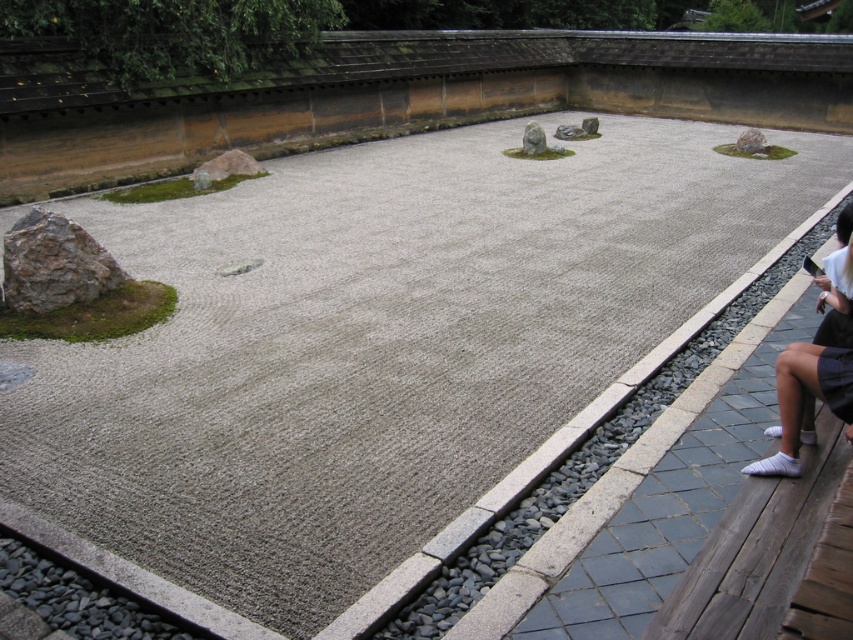
From the picture: Can you confirm if white fabric at right is smaller than rusty brown rock at left?

No.

Between white fabric at right and rusty brown rock at left, which one has more height?

white fabric at right

The height and width of the screenshot is (640, 853). Describe the element at coordinates (805, 400) in the screenshot. I see `white fabric at right` at that location.

At what (x,y) coordinates should I click in order to perform the action: click on white fabric at right. Please return your answer as a coordinate pair (x, y). The width and height of the screenshot is (853, 640). Looking at the image, I should click on (805, 400).